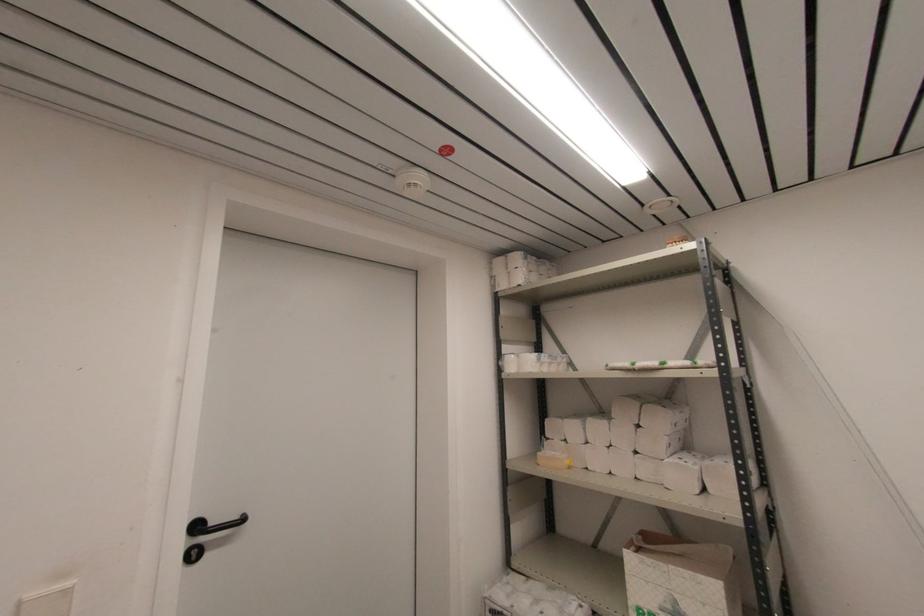
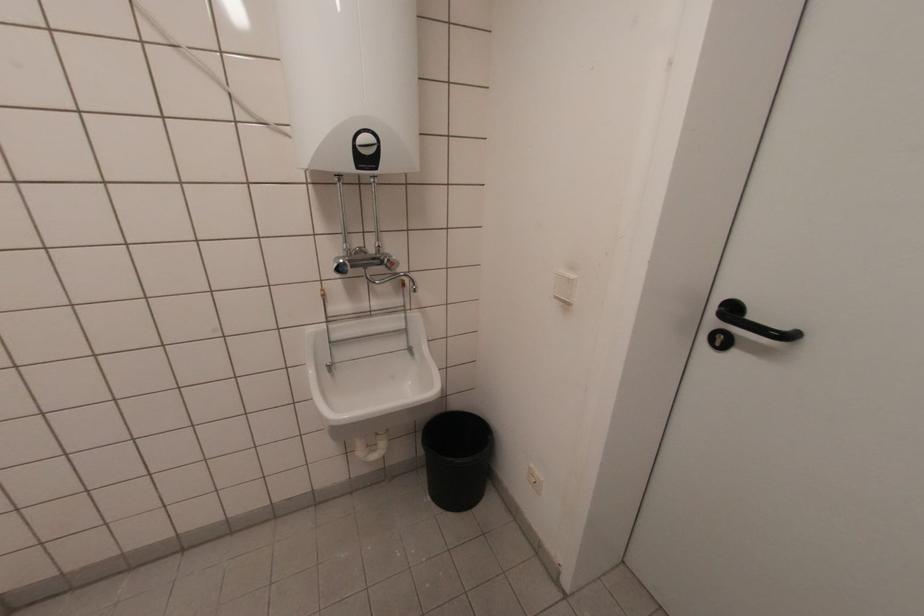
Locate, in the second image, the point that corresponds to (196,557) in the first image.

(719, 344)